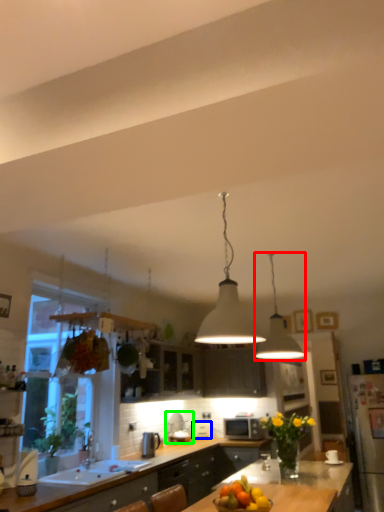
Question: Estimate the real-world distances between objects in this image. Which object is closer to lamp (highlighted by a red box), appliance (highlighted by a blue box) or appliance (highlighted by a green box)?

Choices:
 (A) appliance
 (B) appliance

Answer: (B)